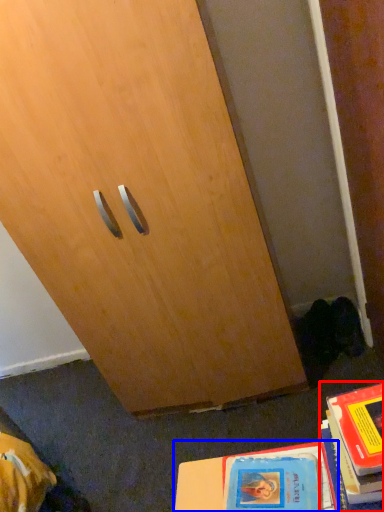
Question: Which object is closer to the camera taking this photo, book (highlighted by a red box) or book (highlighted by a blue box)?

Choices:
 (A) book
 (B) book

Answer: (A)